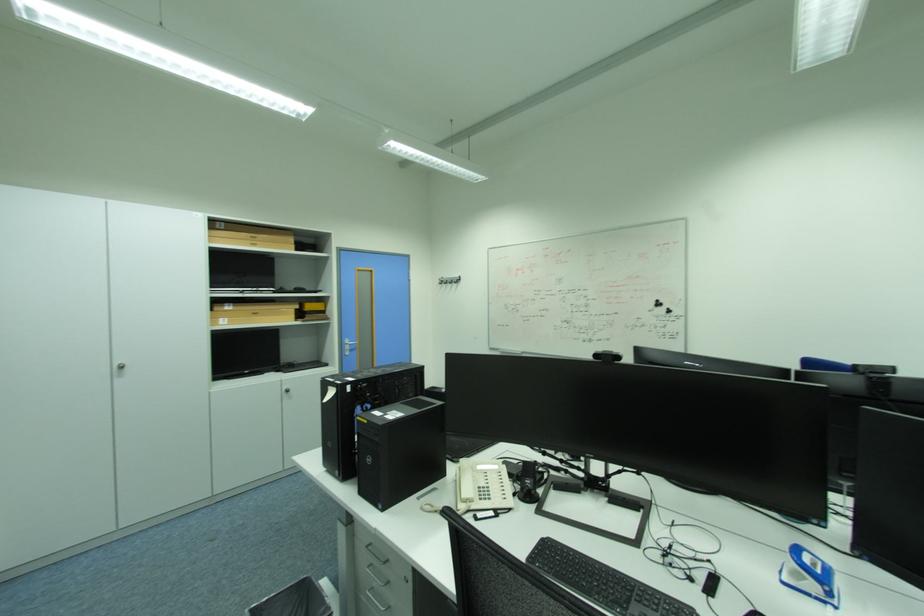
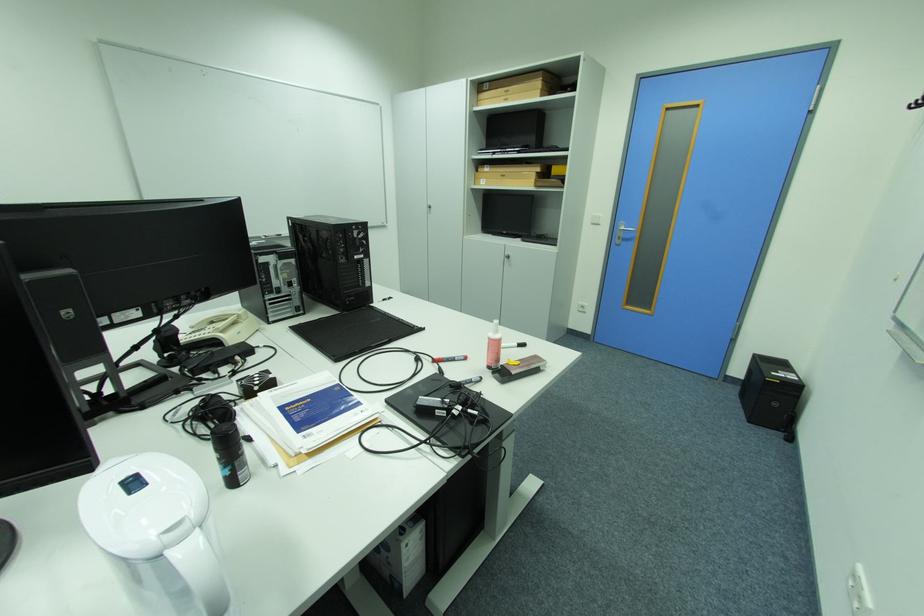
Locate, in the second image, the point that corresponds to the point at 261,246 in the first image.

(514, 100)